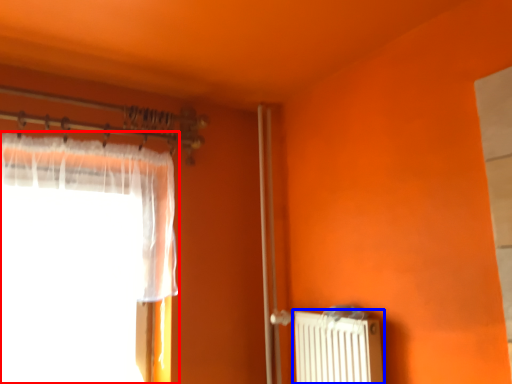
Question: Which of the following is the closest to the observer, curtain (highlighted by a red box) or radiator (highlighted by a blue box)?

Choices:
 (A) curtain
 (B) radiator

Answer: (A)